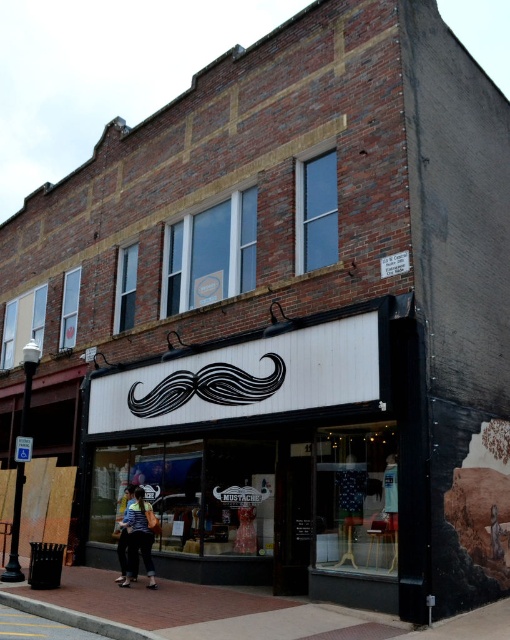
Question: Among these objects, which one is nearest to the camera?

Choices:
 (A) brick pavement at lower center
 (B) striped shirt at center

Answer: (A)

Question: Among these objects, which one is farthest from the camera?

Choices:
 (A) striped shirt at center
 (B) white matte signboard at center
 (C) denim jacket at lower left

Answer: (C)

Question: Is striped shirt at center further to the viewer compared to denim jacket at lower left?

Choices:
 (A) no
 (B) yes

Answer: (A)

Question: Does brick pavement at lower center lie in front of denim jacket at lower left?

Choices:
 (A) yes
 (B) no

Answer: (A)

Question: Which point is closer to the camera taking this photo?

Choices:
 (A) (126, 522)
 (B) (165, 604)

Answer: (B)

Question: Is brick pavement at lower center positioned in front of denim jacket at lower left?

Choices:
 (A) no
 (B) yes

Answer: (B)